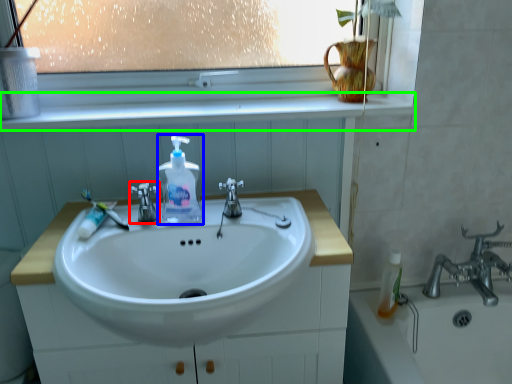
Question: Considering the real-world distances, which object is farthest from tap (highlighted by a red box)? soap dispenser (highlighted by a blue box) or window sill (highlighted by a green box)?

Choices:
 (A) soap dispenser
 (B) window sill

Answer: (B)